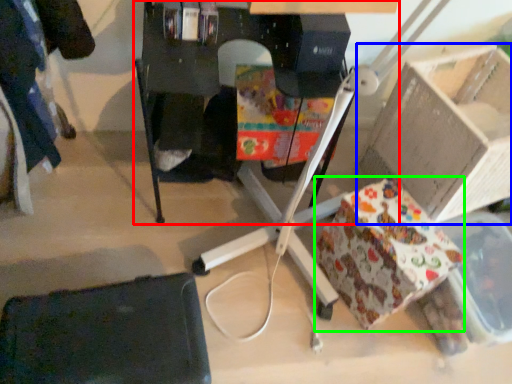
Question: Which object is positioned closest to furniture (highlighted by a red box)? Select from cardboard box (highlighted by a blue box) and wrapping paper (highlighted by a green box).

Choices:
 (A) cardboard box
 (B) wrapping paper

Answer: (A)